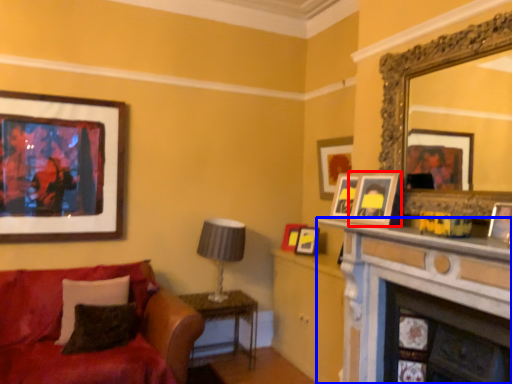
Question: Which object appears closest to the camera in this image, picture frame (highlighted by a red box) or fireplace (highlighted by a blue box)?

Choices:
 (A) picture frame
 (B) fireplace

Answer: (B)